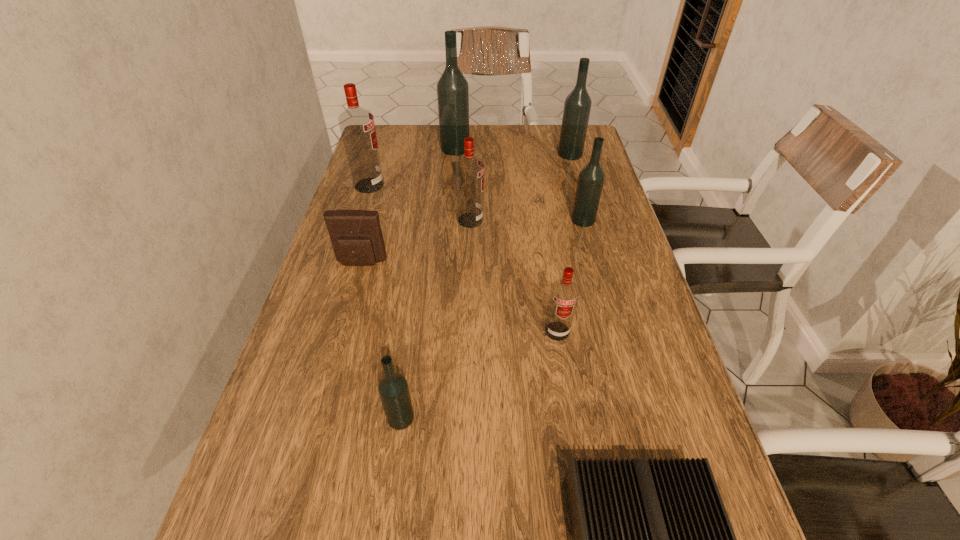
You are a GUI agent. You are given a task and a screenshot of the screen. Output one action in this format:
    pyautogui.click(x=<x>, y=<y>)
    Task: Click on the third closest black vodka to the second nearest black vodka
    The width and height of the screenshot is (960, 540).
    Given the screenshot: What is the action you would take?
    [393, 388]

Locate an element on the screen. red vodka that is the nearest to the second biggest black vodka is located at coordinates (469, 170).

The width and height of the screenshot is (960, 540). What are the coordinates of `red vodka that is the closest one to the third nearest object` in the screenshot? It's located at (469, 170).

Find the location of a particular element. The width and height of the screenshot is (960, 540). vacant space that satisfies the following two spatial constraints: 1. on the front label of the second smallest black vodka; 2. on the left side of the leftmost vodka is located at coordinates click(x=358, y=220).